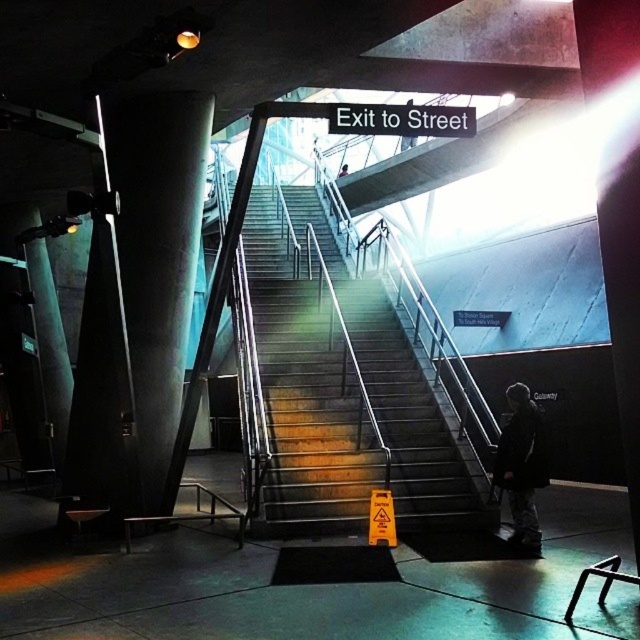
Which is in front, point (502, 445) or point (340, 168)?

Point (502, 445) is more forward.

Describe the element at coordinates (522, 465) in the screenshot. I see `dark gray jacket at lower right` at that location.

The image size is (640, 640). Find the location of `dark gray jacket at lower right`. dark gray jacket at lower right is located at coordinates (522, 465).

Who is taller, metallic gray stairs at center or dark gray jacket at lower right?

Standing taller between the two is metallic gray stairs at center.

Who is more forward, (317,218) or (500,481)?

Positioned in front is point (500,481).

You are a GUI agent. You are given a task and a screenshot of the screen. Output one action in this format:
    pyautogui.click(x=<x>, y=<y>)
    Task: Click on the metallic gray stairs at center
    The height and width of the screenshot is (640, 640).
    Given the screenshot: What is the action you would take?
    pyautogui.click(x=342, y=394)

Between point (152, 337) and point (344, 172), which one is positioned in front?

Point (152, 337) is more forward.

Based on the photo, is the position of sleek concrete pillar at left more distant than that of pink fabric person at center?

No, it is not.

Which is behind, point (134, 220) or point (346, 168)?

The point (346, 168) is more distant.

Find the location of a particular element. This screenshot has width=640, height=640. sleek concrete pillar at left is located at coordinates (156, 256).